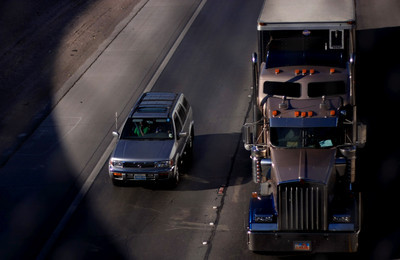
The image size is (400, 260). What are the coordinates of `window` in the screenshot? It's located at (148, 125), (292, 133), (328, 136), (177, 126), (181, 114), (187, 104).